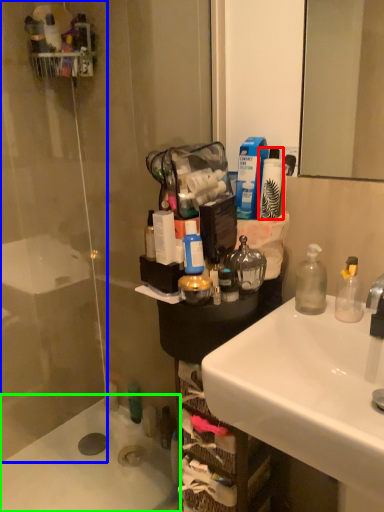
Question: Based on their relative distances, which object is nearer to toiletry (highlighted by a red box)? Choose from glass door (highlighted by a blue box) and bath (highlighted by a green box).

Choices:
 (A) glass door
 (B) bath

Answer: (A)